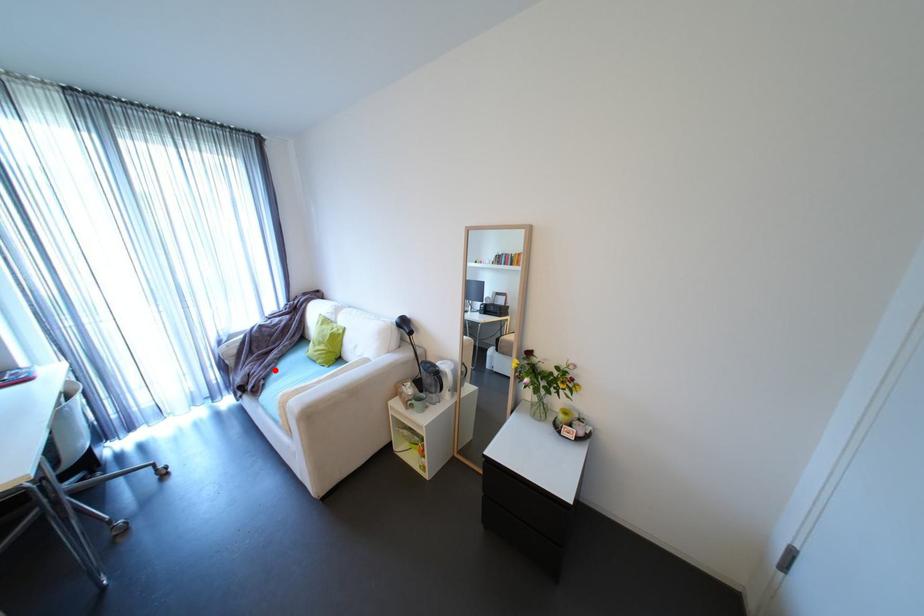
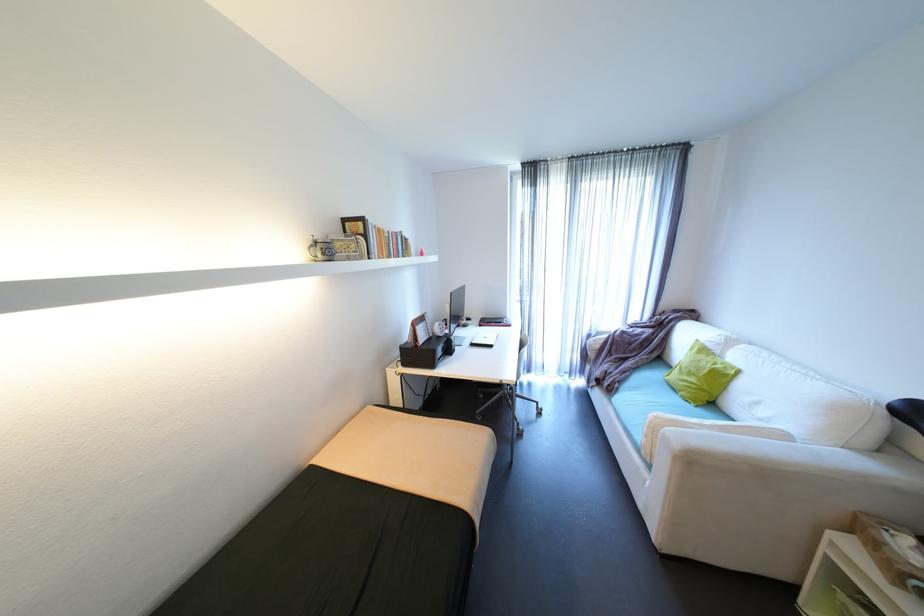
Find the pixel in the second image that matches the highlighted location in the first image.

(630, 377)